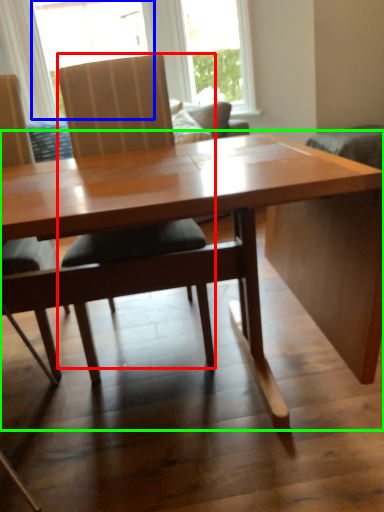
Question: Which is farther away from chair (highlighted by a red box)? window (highlighted by a blue box) or table (highlighted by a green box)?

Choices:
 (A) window
 (B) table

Answer: (A)